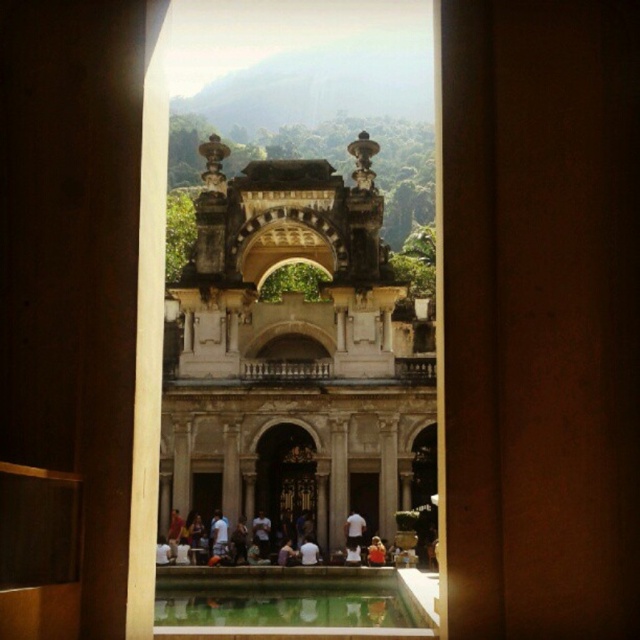
Can you confirm if white marble pillar at center is bigger than white cotton shirt at center?

Yes, white marble pillar at center is bigger than white cotton shirt at center.

Does white marble pillar at center appear on the left side of white cotton shirt at center?

Indeed, white marble pillar at center is positioned on the left side of white cotton shirt at center.

The height and width of the screenshot is (640, 640). What do you see at coordinates (337, 483) in the screenshot?
I see `white marble pillar at center` at bounding box center [337, 483].

Where is `white marble pillar at center`? white marble pillar at center is located at coordinates (337, 483).

Is point (236, 452) closer to viewer compared to point (356, 545)?

No.

Is the position of transparent glass window at center less distant than that of white matte shirt at center?

That is True.

Image resolution: width=640 pixels, height=640 pixels. What do you see at coordinates (292, 314) in the screenshot?
I see `transparent glass window at center` at bounding box center [292, 314].

At what (x,y) coordinates should I click in order to perform the action: click on transparent glass window at center. Please return your answer as a coordinate pair (x, y). The width and height of the screenshot is (640, 640). Looking at the image, I should click on (292, 314).

Can you confirm if transparent glass window at center is taller than white cotton shirt at center?

Correct, transparent glass window at center is much taller as white cotton shirt at center.

Looking at this image, is transparent glass window at center thinner than white cotton shirt at center?

In fact, transparent glass window at center might be wider than white cotton shirt at center.

I want to click on transparent glass window at center, so click(292, 314).

Where is `transparent glass window at center`? transparent glass window at center is located at coordinates click(x=292, y=314).